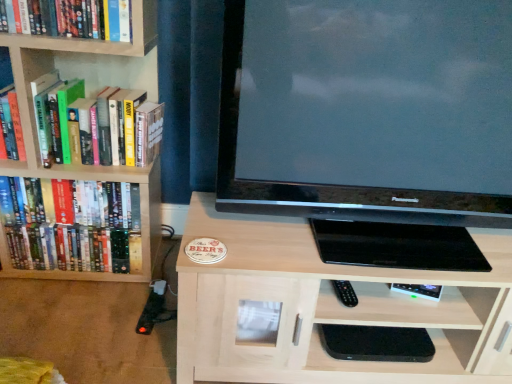
What are the coordinates of `blank area beneath matte black television at center (from a real-world perspective)` in the screenshot? It's located at (373, 242).